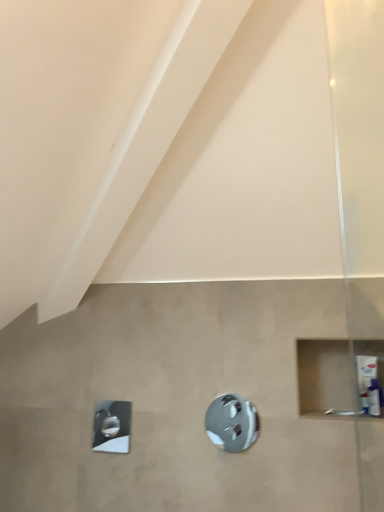
Question: Is white plastic tube at right completely or partially inside polished chrome shower at center, the 2th shower viewed from the back?

Choices:
 (A) no
 (B) yes

Answer: (A)

Question: From a real-world perspective, is polished chrome shower at center, the 2th shower viewed from the back, over white plastic tube at right?

Choices:
 (A) yes
 (B) no

Answer: (B)

Question: Can you confirm if polished chrome shower at center, placed as the 1th shower when sorted from front to back, is smaller than white plastic tube at right?

Choices:
 (A) yes
 (B) no

Answer: (A)

Question: Is polished chrome shower at center, the 2th shower viewed from the back, next to white plastic tube at right?

Choices:
 (A) no
 (B) yes

Answer: (A)

Question: Does polished chrome shower at center, which is counted as the second shower, starting from the left, have a greater height compared to white plastic tube at right?

Choices:
 (A) yes
 (B) no

Answer: (A)

Question: From the image's perspective, is polished chrome showerhead at lower left, the first shower positioned from the left, above or below polished chrome shower at center, which is counted as the second shower, starting from the left?

Choices:
 (A) below
 (B) above

Answer: (A)

Question: Choose the correct answer: Is polished chrome showerhead at lower left, the first shower positioned from the left, inside polished chrome shower at center, which is counted as the second shower, starting from the left, or outside it?

Choices:
 (A) inside
 (B) outside

Answer: (B)

Question: From a real-world perspective, is polished chrome showerhead at lower left, the first shower positioned from the left, positioned above or below polished chrome shower at center, the 1th shower viewed from the right?

Choices:
 (A) above
 (B) below

Answer: (B)

Question: Considering their positions, is polished chrome showerhead at lower left, the first shower from the back, located in front of or behind polished chrome shower at center, placed as the 1th shower when sorted from front to back?

Choices:
 (A) front
 (B) behind

Answer: (B)

Question: Which is correct: polished chrome shower at center, placed as the 1th shower when sorted from front to back, is inside white plastic tube at right, or outside of it?

Choices:
 (A) inside
 (B) outside

Answer: (B)

Question: In terms of height, does polished chrome shower at center, the 1th shower viewed from the right, look taller or shorter compared to white plastic tube at right?

Choices:
 (A) short
 (B) tall

Answer: (B)

Question: In the image, is polished chrome shower at center, placed as the 1th shower when sorted from front to back, positioned in front of or behind white plastic tube at right?

Choices:
 (A) front
 (B) behind

Answer: (B)

Question: From the image's perspective, is polished chrome shower at center, the 2th shower viewed from the back, positioned above or below white plastic tube at right?

Choices:
 (A) above
 (B) below

Answer: (B)

Question: Is white plastic tube at right bigger or smaller than polished chrome showerhead at lower left, the first shower positioned from the left?

Choices:
 (A) big
 (B) small

Answer: (B)

Question: Considering the positions of white plastic tube at right and polished chrome showerhead at lower left, which appears as the second shower when viewed from the right, in the image, is white plastic tube at right taller or shorter than polished chrome showerhead at lower left, which appears as the second shower when viewed from the right,?

Choices:
 (A) tall
 (B) short

Answer: (B)